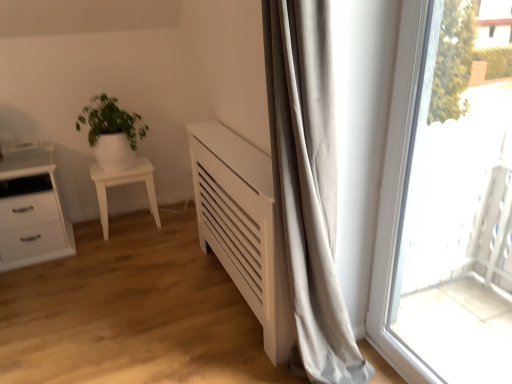
Measure the distance between white glossy side table at left and camera.

white glossy side table at left and camera are 2.67 meters apart from each other.

The image size is (512, 384). I want to click on white glossy pot at left, so click(x=111, y=132).

What do you see at coordinates (31, 208) in the screenshot?
I see `white glossy chest of drawers at left` at bounding box center [31, 208].

Locate an element on the screen. transparent glass window at right is located at coordinates (444, 213).

Is transparent glass window at right located within white glossy pot at left?

Actually, transparent glass window at right is outside white glossy pot at left.

Which object is thinner, white glossy pot at left or transparent glass window at right?

transparent glass window at right is thinner.

The width and height of the screenshot is (512, 384). I want to click on houseplant that is on the left side of transparent glass window at right, so click(111, 132).

Is white glossy side table at left aimed at white glossy chest of drawers at left?

No, white glossy side table at left is not turned towards white glossy chest of drawers at left.

How many degrees apart are the facing directions of white glossy side table at left and white glossy chest of drawers at left?

The facing directions of white glossy side table at left and white glossy chest of drawers at left are 2.68 degrees apart.

Is point (154, 212) farther from camera compared to point (8, 176)?

Yes, it is behind point (8, 176).

From the image's perspective, is white glossy side table at left located beneath white glossy chest of drawers at left?

No.

Can you confirm if white glossy chest of drawers at left is shorter than white glossy side table at left?

No.

Does white glossy chest of drawers at left have a lesser width compared to white glossy side table at left?

Incorrect, the width of white glossy chest of drawers at left is not less than that of white glossy side table at left.

Which object is further away from the camera taking this photo, white glossy chest of drawers at left or white glossy side table at left?

white glossy side table at left is further away from the camera.

Which is in front, point (55, 203) or point (156, 206)?

The point (55, 203) is closer to the camera.

Is transparent glass window at right smaller than white glossy side table at left?

Indeed, transparent glass window at right has a smaller size compared to white glossy side table at left.

Which of these two, transparent glass window at right or white glossy side table at left, is wider?

Wider between the two is white glossy side table at left.

What's the angular difference between transparent glass window at right and white glossy side table at left's facing directions?

89 degrees.

From the image's perspective, which is above, transparent glass window at right or white glossy side table at left?

white glossy side table at left appears higher in the image.

Is white glossy chest of drawers at left looking in the opposite direction of white glossy pot at left?

No, white glossy chest of drawers at left's orientation is not away from white glossy pot at left.

Is white glossy chest of drawers at left further to camera compared to white glossy pot at left?

No, white glossy chest of drawers at left is in front of white glossy pot at left.

From the image's perspective, is white glossy chest of drawers at left above white glossy pot at left?

No, from the image's perspective, white glossy chest of drawers at left is not over white glossy pot at left.

In the scene shown: Is white glossy pot at left surrounded by white glossy chest of drawers at left?

That's incorrect, white glossy pot at left is not inside white glossy chest of drawers at left.

Is white glossy pot at left with white glossy side table at left?

No, white glossy pot at left is not making contact with white glossy side table at left.

Considering the sizes of white glossy pot at left and white glossy side table at left in the image, is white glossy pot at left wider or thinner than white glossy side table at left?

In the image, white glossy pot at left appears to be wider than white glossy side table at left.

In terms of size, does white glossy pot at left appear bigger or smaller than white glossy side table at left?

white glossy pot at left is bigger than white glossy side table at left.

Can you confirm if white glossy pot at left is positioned to the right of white glossy side table at left?

Incorrect, white glossy pot at left is not on the right side of white glossy side table at left.

Is white glossy side table at left not close to transparent glass window at right?

Yes, white glossy side table at left and transparent glass window at right are located far from each other.

What are the coordinates of `furniture lying above the transparent glass window at right (from the image's perspective)` in the screenshot? It's located at (124, 184).

What's the angular difference between white glossy side table at left and transparent glass window at right's facing directions?

The angular difference between white glossy side table at left and transparent glass window at right is 89 degrees.

I want to click on houseplant lying on the left of transparent glass window at right, so click(x=111, y=132).

You are a GUI agent. You are given a task and a screenshot of the screen. Output one action in this format:
    pyautogui.click(x=<x>, y=<y>)
    Task: Click on the chest of drawers that is above the white glossy side table at left (from a real-world perspective)
    The height and width of the screenshot is (384, 512).
    Given the screenshot: What is the action you would take?
    pyautogui.click(x=31, y=208)

Based on their spatial positions, is white glossy pot at left or white glossy side table at left further from white glossy chest of drawers at left?

white glossy pot at left lies further to white glossy chest of drawers at left than the other object.

Which object lies nearer to the anchor point white glossy pot at left, white glossy chest of drawers at left or white glossy side table at left?

white glossy side table at left is closer to white glossy pot at left.

Looking at the image, which one is located closer to white glossy pot at left, transparent glass window at right or white glossy chest of drawers at left?

white glossy chest of drawers at left.

Estimate the real-world distances between objects in this image. Which object is further from white glossy chest of drawers at left, transparent glass window at right or white glossy pot at left?

transparent glass window at right is further to white glossy chest of drawers at left.

Considering their positions, is white glossy pot at left positioned closer to transparent glass window at right than white glossy chest of drawers at left?

white glossy pot at left.

From the picture: Based on their spatial positions, is white glossy side table at left or white glossy chest of drawers at left further from transparent glass window at right?

white glossy chest of drawers at left.

Looking at the image, which one is located further to white glossy pot at left, white glossy side table at left or transparent glass window at right?

transparent glass window at right is further to white glossy pot at left.

When comparing their distances from white glossy pot at left, does white glossy chest of drawers at left or transparent glass window at right seem further?

transparent glass window at right.

You are a GUI agent. You are given a task and a screenshot of the screen. Output one action in this format:
    pyautogui.click(x=<x>, y=<y>)
    Task: Click on the houseplant located between white glossy chest of drawers at left and white glossy side table at left in the left-right direction
    This screenshot has width=512, height=384.
    Given the screenshot: What is the action you would take?
    pyautogui.click(x=111, y=132)

The image size is (512, 384). What are the coordinates of `houseplant located between transparent glass window at right and white glossy side table at left in the depth direction` in the screenshot? It's located at (111, 132).

Find the location of a particular element. The image size is (512, 384). furniture between white glossy chest of drawers at left and transparent glass window at right in the horizontal direction is located at coordinates (124, 184).

Where is `houseplant located between white glossy chest of drawers at left and transparent glass window at right in the left-right direction`? Image resolution: width=512 pixels, height=384 pixels. houseplant located between white glossy chest of drawers at left and transparent glass window at right in the left-right direction is located at coordinates (111, 132).